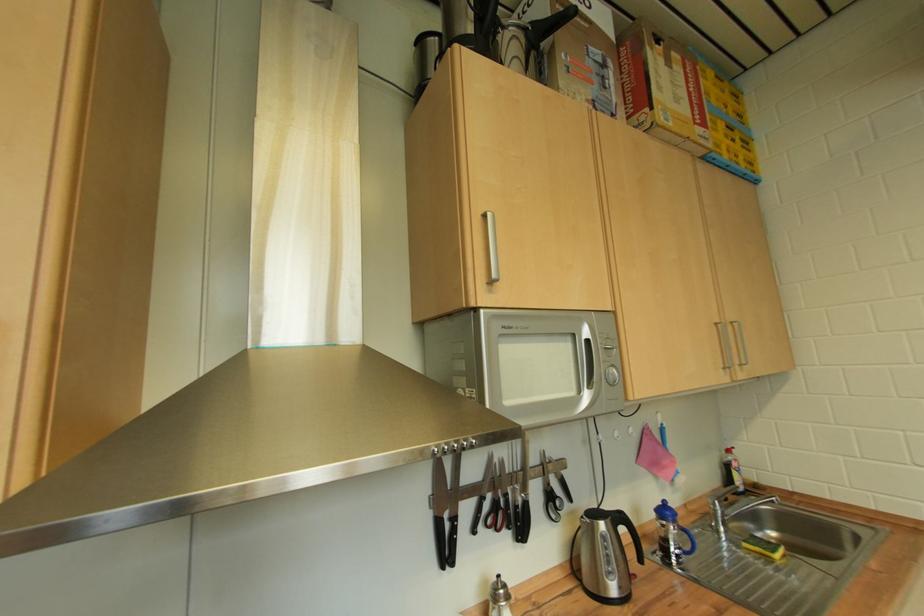
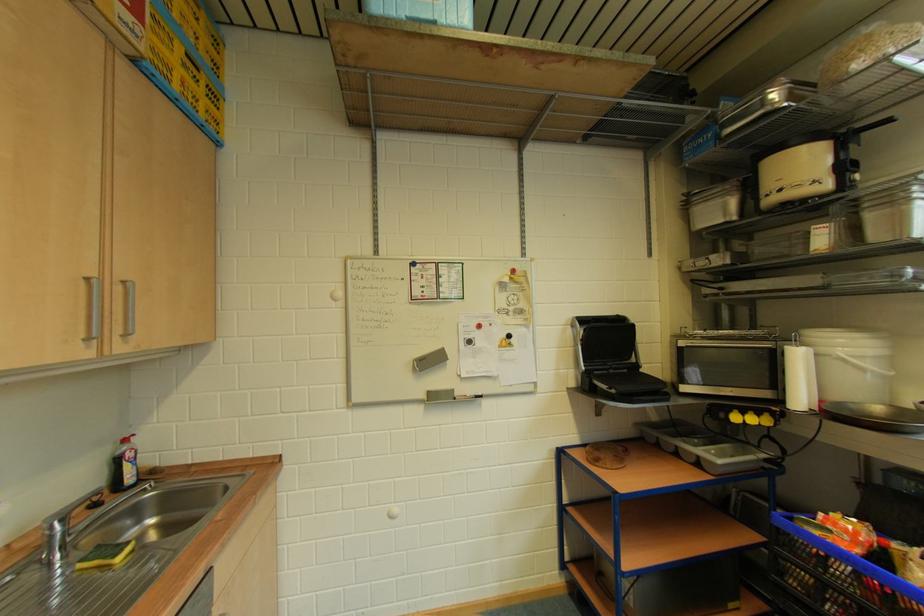
In the second image, find the point that corresponds to the point at 723,514 in the first image.

(61, 539)